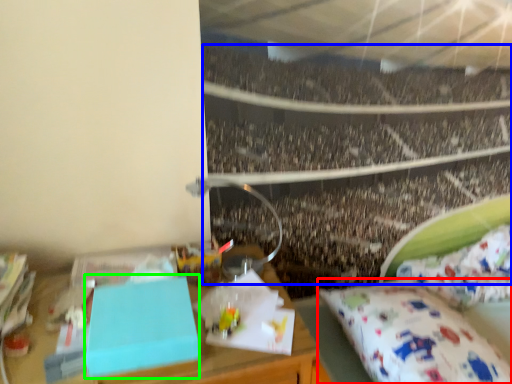
Question: Considering the real-world distances, which object is farthest from mattress (highlighted by a red box)? crowd (highlighted by a blue box) or box (highlighted by a green box)?

Choices:
 (A) crowd
 (B) box

Answer: (A)